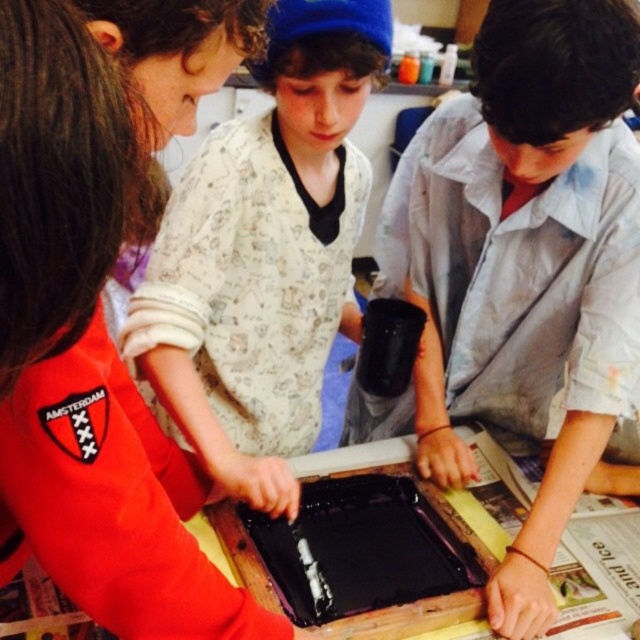
Based on the photo, measure the distance between matte black tray at center and camera.

They are 11.12 inches apart.

Measure the distance between point [1,516] and camera.

Point [1,516] is 24.36 inches from camera.

Locate an element on the screen. This screenshot has height=640, width=640. matte black tray at center is located at coordinates (100, 307).

Is point (93, 51) positioned behind point (602, 280)?

That is False.

Who is positioned more to the right, matte black tray at center or light gray cotton shirt at center?

Positioned to the right is light gray cotton shirt at center.

Which is in front, point (72, 26) or point (592, 349)?

Positioned in front is point (72, 26).

Locate an element on the screen. This screenshot has height=640, width=640. matte black tray at center is located at coordinates (100, 307).

Can you confirm if matte white shirt at center is positioned to the left of black plastic tray at center?

Indeed, matte white shirt at center is positioned on the left side of black plastic tray at center.

Between point (212, 468) and point (276, 524), which one is positioned in front?

Point (212, 468) is more forward.

Which is in front, point (227, 221) or point (428, 572)?

Point (428, 572)

Locate an element on the screen. The height and width of the screenshot is (640, 640). matte white shirt at center is located at coordinates (264, 256).